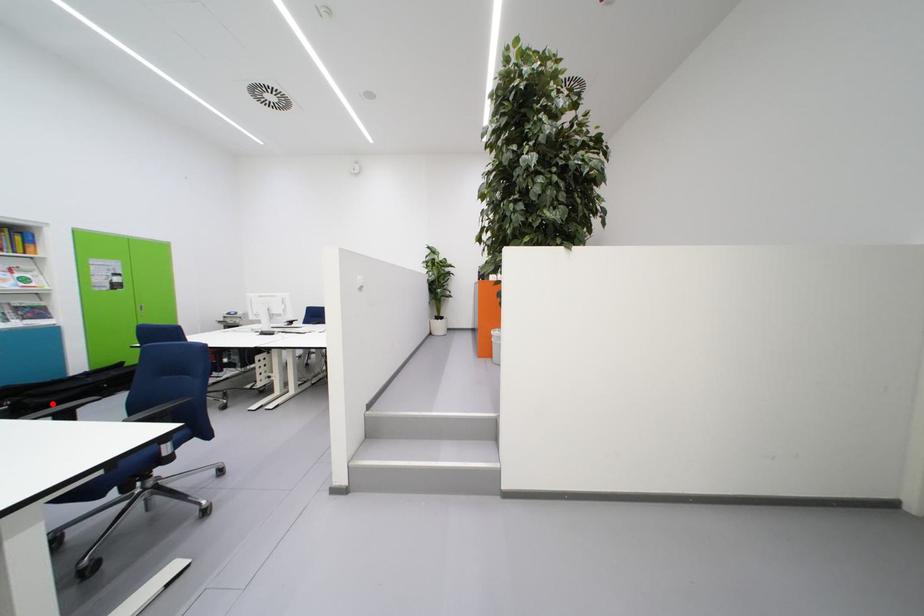
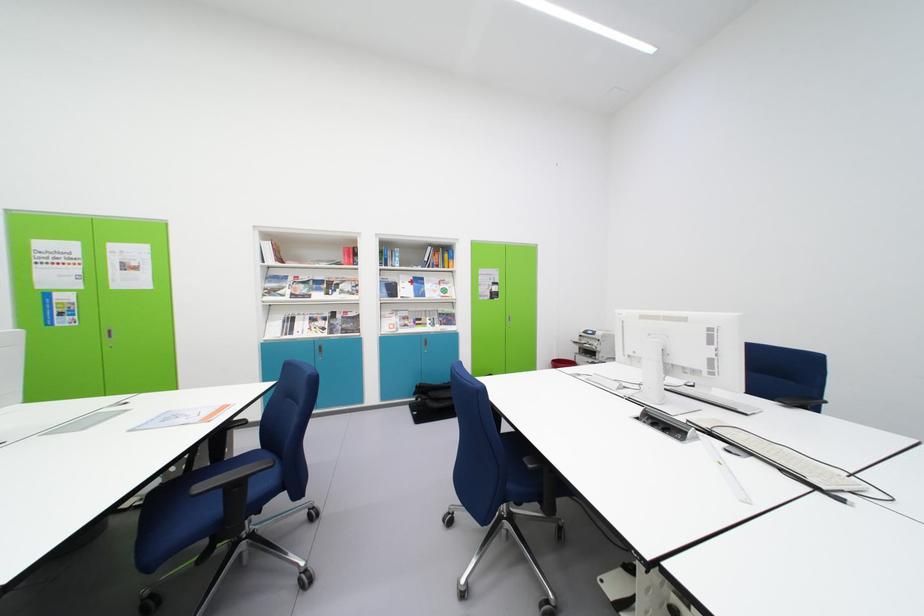
Locate, in the second image, the point that corresponds to the highlighted location in the first image.

(442, 408)